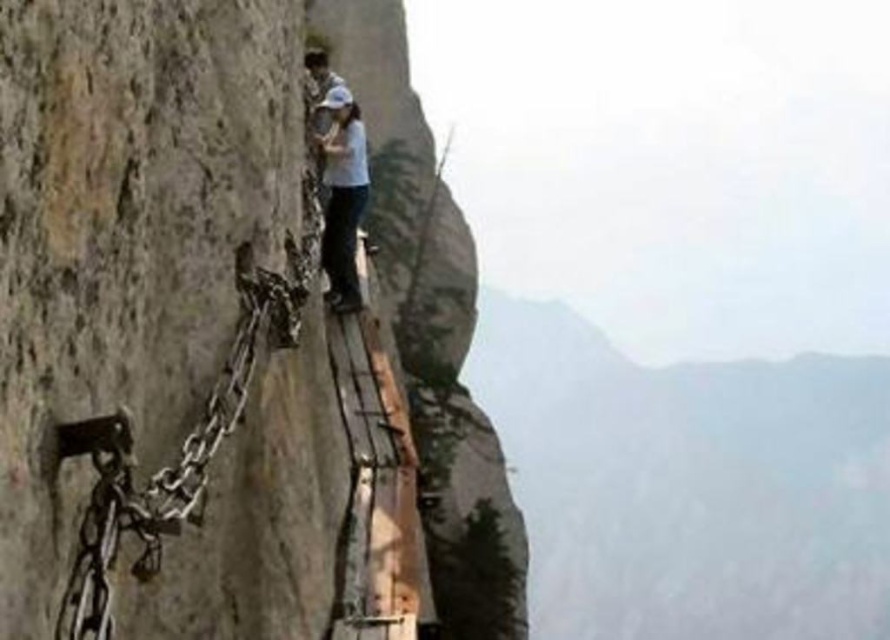
Who is more distant from viewer, (x=761, y=532) or (x=346, y=221)?

The point (x=761, y=532) is more distant.

Can you confirm if rugged stone mountain at upper center is smaller than white matte shirt at center?

No, rugged stone mountain at upper center is not smaller than white matte shirt at center.

This screenshot has height=640, width=890. What are the coordinates of `rugged stone mountain at upper center` in the screenshot? It's located at (688, 484).

Where is `rugged stone mountain at upper center`? The width and height of the screenshot is (890, 640). rugged stone mountain at upper center is located at coordinates (688, 484).